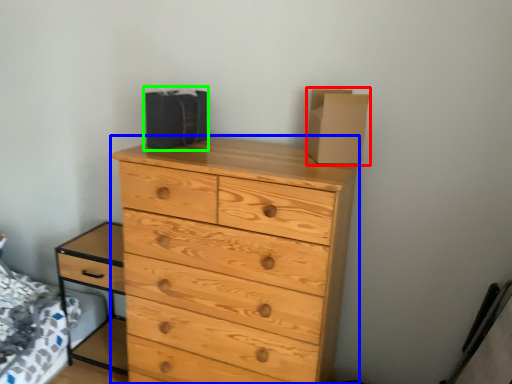
Question: Estimate the real-world distances between objects in this image. Which object is closer to cardboard box (highlighted by a red box), chest of drawers (highlighted by a blue box) or cardboard box (highlighted by a green box)?

Choices:
 (A) chest of drawers
 (B) cardboard box

Answer: (A)